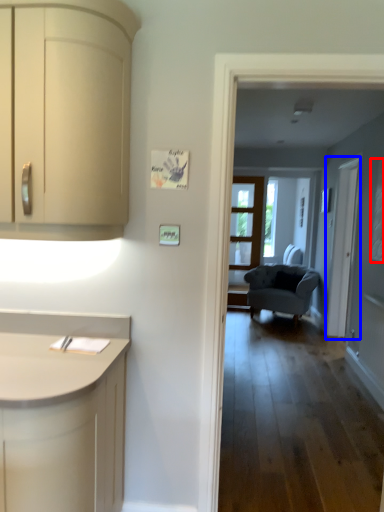
Question: Among these objects, which one is nearest to the camera, window (highlighted by a red box) or screen door (highlighted by a blue box)?

Choices:
 (A) window
 (B) screen door

Answer: (A)